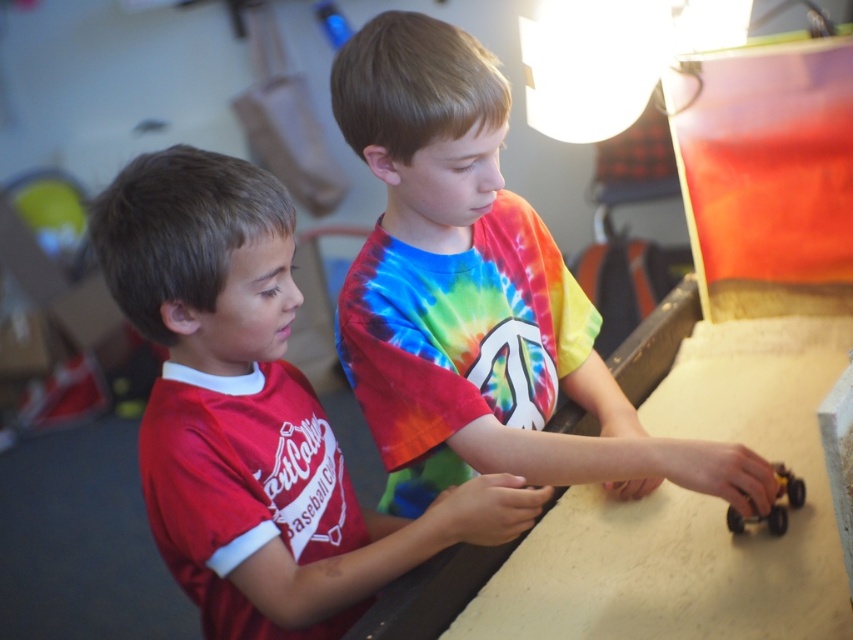
Question: Does rainbow tie-dye shirt at center have a larger size compared to metallic yellow toy car at lower right?

Choices:
 (A) no
 (B) yes

Answer: (B)

Question: Is rainbow tie-dye shirt at center further to the viewer compared to matte red shirt at left?

Choices:
 (A) yes
 (B) no

Answer: (A)

Question: Can you confirm if rainbow tie-dye shirt at center is positioned above matte red shirt at left?

Choices:
 (A) no
 (B) yes

Answer: (B)

Question: Which of the following is the closest to the observer?

Choices:
 (A) metallic yellow toy car at lower right
 (B) rainbow tie-dye shirt at center
 (C) matte red shirt at left

Answer: (C)

Question: Which point is closer to the camera?

Choices:
 (A) (247, 556)
 (B) (784, 513)
 (C) (488, 179)

Answer: (A)

Question: Which point is farther to the camera?

Choices:
 (A) matte red shirt at left
 (B) rainbow tie-dye shirt at center
 (C) metallic yellow toy car at lower right

Answer: (C)